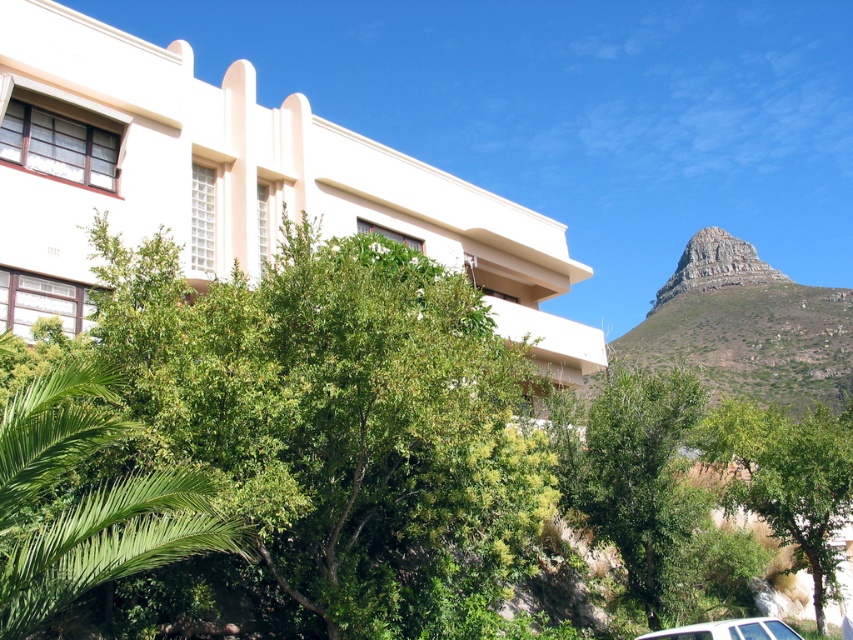
Who is taller, green leafy tree at lower right or white matte car at lower right?

With more height is green leafy tree at lower right.

Is point (817, 429) less distant than point (729, 628)?

No, it is not.

Does point (833, 595) lie in front of point (642, 636)?

No, it is not.

I want to click on green leafy tree at lower right, so (x=787, y=477).

Which is behind, point (354, 582) or point (694, 636)?

Positioned behind is point (354, 582).

Based on the photo, who is more forward, [120,428] or [659,630]?

Positioned in front is point [120,428].

Which is in front, point (474, 369) or point (708, 621)?

Point (708, 621) is in front.

The image size is (853, 640). In order to click on green leafy tree at center in this screenshot , I will do `click(288, 438)`.

Between white matte building at upper center and green leafy palm at lower left, which one appears on the right side from the viewer's perspective?

Positioned to the right is white matte building at upper center.

Between point (39, 184) and point (33, 579), which one is positioned in front?

Point (33, 579) is in front.

What do you see at coordinates (230, 182) in the screenshot?
I see `white matte building at upper center` at bounding box center [230, 182].

You are a GUI agent. You are given a task and a screenshot of the screen. Output one action in this format:
    pyautogui.click(x=<x>, y=<y>)
    Task: Click on the white matte building at upper center
    
    Given the screenshot: What is the action you would take?
    pyautogui.click(x=230, y=182)